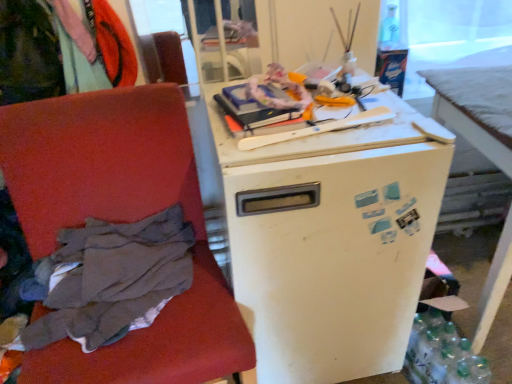
What do you see at coordinates (121, 221) in the screenshot?
I see `velvet-like red chair at left` at bounding box center [121, 221].

Image resolution: width=512 pixels, height=384 pixels. In order to click on white matte desk at right in this screenshot , I will do `click(477, 108)`.

Looking at this image, measure the distance between dark gray fabric at left, acting as the 2th clothing starting from the left, and camera.

dark gray fabric at left, acting as the 2th clothing starting from the left, is 91.00 centimeters away from camera.

What is the approximate width of dark gray fabric at left, the 1th clothing positioned from the right?

It is 12.33 inches.

Describe the element at coordinates (332, 237) in the screenshot. I see `white matte refrigerator at center` at that location.

The image size is (512, 384). I want to click on velvet-like red chair at left, so click(121, 221).

From a real-world perspective, is velvet-like fabric at upper left, the 1th clothing positioned from the top, on clear plastic bottles at lower right?

Yes, from a real-world perspective, velvet-like fabric at upper left, the 1th clothing positioned from the top, is above clear plastic bottles at lower right.

Who is taller, velvet-like fabric at upper left, the 1th clothing positioned from the top, or clear plastic bottles at lower right?

velvet-like fabric at upper left, the 1th clothing positioned from the top.

Is velvet-like fabric at upper left, which is the first clothing in left-to-right order, far away from clear plastic bottles at lower right?

Yes, velvet-like fabric at upper left, which is the first clothing in left-to-right order, is far from clear plastic bottles at lower right.

Is point (469, 133) farther from camera compared to point (68, 296)?

Yes, point (469, 133) is farther from viewer.

In terms of size, does white matte desk at right appear bigger or smaller than dark gray fabric at left, the 1th clothing positioned from the right?

white matte desk at right is bigger than dark gray fabric at left, the 1th clothing positioned from the right.

Where is `clothing in front of the white matte desk at right`? This screenshot has height=384, width=512. clothing in front of the white matte desk at right is located at coordinates click(x=109, y=279).

Which is nearer, (x=204, y=245) or (x=372, y=157)?

Clearly, point (x=204, y=245) is more distant from the camera than point (x=372, y=157).

Does velvet-like red chair at left have a greater width compared to white matte refrigerator at center?

Incorrect, the width of velvet-like red chair at left does not surpass that of white matte refrigerator at center.

In the scene shown: Is velvet-like red chair at left closer to the viewer compared to white matte refrigerator at center?

Yes, velvet-like red chair at left is closer to the camera.

Can you confirm if velvet-like red chair at left is positioned to the left of white matte refrigerator at center?

Correct, you'll find velvet-like red chair at left to the left of white matte refrigerator at center.

In the scene shown: From a real-world perspective, is wooden skateboard at upper center under velvet-like red chair at left?

No, from a real-world perspective, wooden skateboard at upper center is not under velvet-like red chair at left.

How different are the orientations of wooden skateboard at upper center and velvet-like red chair at left in degrees?

3.15 degrees separate the facing orientations of wooden skateboard at upper center and velvet-like red chair at left.

Where is `equipment that is behind the velvet-like red chair at left`? The image size is (512, 384). equipment that is behind the velvet-like red chair at left is located at coordinates (318, 128).

Does wooden skateboard at upper center have a greater width compared to velvet-like red chair at left?

Incorrect, the width of wooden skateboard at upper center does not surpass that of velvet-like red chair at left.

Which is behind, point (464, 349) or point (50, 306)?

The point (464, 349) is behind.

How different are the orientations of clear plastic bottles at lower right and dark gray fabric at left, which is the 2th clothing from top to bottom, in degrees?

clear plastic bottles at lower right and dark gray fabric at left, which is the 2th clothing from top to bottom, are facing 1.79 degrees away from each other.

Looking at this image, which of these two, clear plastic bottles at lower right or dark gray fabric at left, acting as the 2th clothing starting from the left, is bigger?

dark gray fabric at left, acting as the 2th clothing starting from the left, is bigger.

From a real-world perspective, which object rests below the other?

clear plastic bottles at lower right is physically lower.

From the image's perspective, is white matte refrigerator at center above or below white matte desk at right?

From the image's perspective, white matte refrigerator at center appears below white matte desk at right.

Would you say white matte refrigerator at center is a long distance from white matte desk at right?

No.

From a real-world perspective, is white matte refrigerator at center beneath white matte desk at right?

No, from a real-world perspective, white matte refrigerator at center is not below white matte desk at right.

Is white matte refrigerator at center at the left side of white matte desk at right?

Yes, white matte refrigerator at center is to the left of white matte desk at right.

Is white matte desk at right in contact with wooden skateboard at upper center?

No, white matte desk at right is not making contact with wooden skateboard at upper center.

Can you confirm if white matte desk at right is taller than wooden skateboard at upper center?

Correct, white matte desk at right is much taller as wooden skateboard at upper center.

Is white matte desk at right bigger or smaller than wooden skateboard at upper center?

Clearly, white matte desk at right is larger in size than wooden skateboard at upper center.

The image size is (512, 384). I want to click on the 2nd clothing to the left when counting from the clear plastic bottles at lower right, so 47,51.

Locate an element on the screen. the 1st clothing directly above the white matte desk at right (from a real-world perspective) is located at coordinates (109, 279).

When comparing their distances from white matte refrigerator at center, does wooden skateboard at upper center or clear plastic bottles at lower right seem closer?

wooden skateboard at upper center.

Which object lies further to the anchor point clear plastic bottles at lower right, white matte desk at right or velvet-like red chair at left?

velvet-like red chair at left.

Estimate the real-world distances between objects in this image. Which object is closer to velvet-like fabric at upper left, which is the second clothing in bottom-to-top order, dark gray fabric at left, acting as the first clothing starting from the bottom, or wooden skateboard at upper center?

dark gray fabric at left, acting as the first clothing starting from the bottom, is closer to velvet-like fabric at upper left, which is the second clothing in bottom-to-top order.

Estimate the real-world distances between objects in this image. Which object is closer to white matte desk at right, dark gray fabric at left, acting as the first clothing starting from the bottom, or wooden skateboard at upper center?

The object closer to white matte desk at right is wooden skateboard at upper center.

From the picture: Which object lies nearer to the anchor point wooden skateboard at upper center, dark gray fabric at left, which is the 2th clothing from top to bottom, or white matte refrigerator at center?

white matte refrigerator at center.

Considering their positions, is clear plastic bottles at lower right positioned closer to dark gray fabric at left, acting as the 2th clothing starting from the left, than wooden skateboard at upper center?

wooden skateboard at upper center.

Considering their positions, is white matte refrigerator at center positioned further to clear plastic bottles at lower right than velvet-like fabric at upper left, which is the first clothing in left-to-right order?

The object further to clear plastic bottles at lower right is velvet-like fabric at upper left, which is the first clothing in left-to-right order.

Estimate the real-world distances between objects in this image. Which object is further from clear plastic bottles at lower right, white matte desk at right or wooden skateboard at upper center?

wooden skateboard at upper center.

In order to click on chair between velvet-like fabric at upper left, acting as the second clothing starting from the right, and white matte refrigerator at center from left to right in this screenshot , I will do coord(121,221).

Identify the location of clothing between velvet-like fabric at upper left, which is the first clothing in left-to-right order, and wooden skateboard at upper center from left to right. (109, 279).

You are a GUI agent. You are given a task and a screenshot of the screen. Output one action in this format:
    pyautogui.click(x=<x>, y=<y>)
    Task: Click on the refrigerator between velvet-like red chair at left and clear plastic bottles at lower right in the horizontal direction
    This screenshot has width=512, height=384.
    Given the screenshot: What is the action you would take?
    pyautogui.click(x=332, y=237)

You are a GUI agent. You are given a task and a screenshot of the screen. Output one action in this format:
    pyautogui.click(x=<x>, y=<y>)
    Task: Click on the equipment between dark gray fabric at left, acting as the first clothing starting from the bottom, and white matte refrigerator at center
    
    Given the screenshot: What is the action you would take?
    pyautogui.click(x=318, y=128)